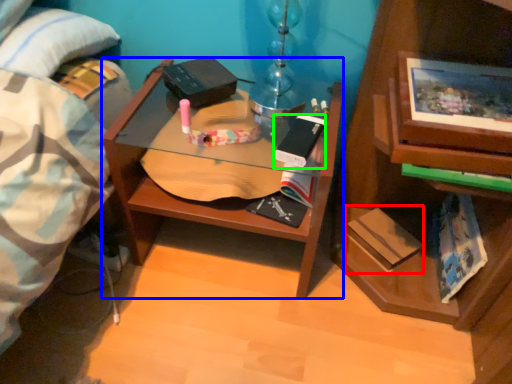
Question: Which object is the farthest from paperback book (highlighted by a red box)? Choose among these: desk (highlighted by a blue box) or paperback book (highlighted by a green box).

Choices:
 (A) desk
 (B) paperback book

Answer: (A)